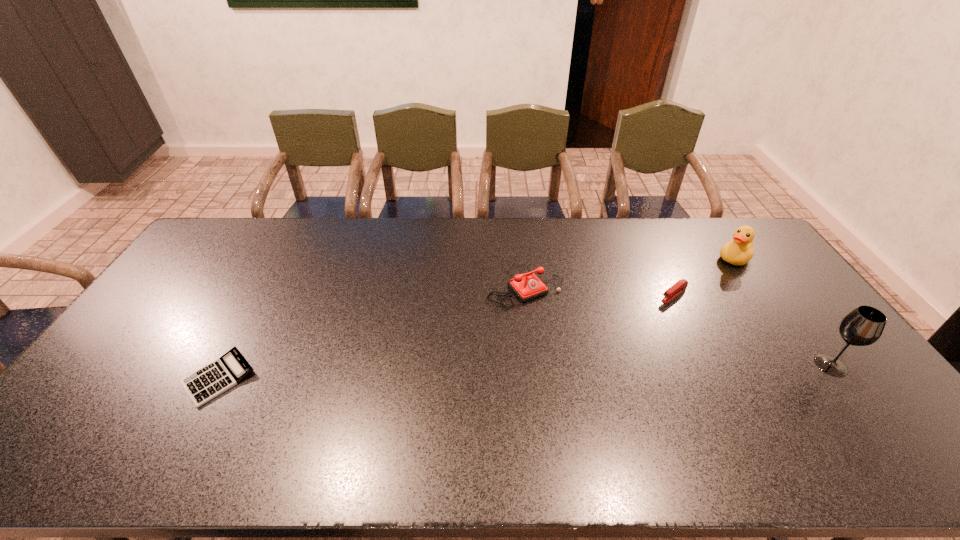
Where is `vacant spot on the desktop that is between the calculator and the wineglass and is positioned on the dial of the telephone`? vacant spot on the desktop that is between the calculator and the wineglass and is positioned on the dial of the telephone is located at coordinates (600, 370).

Find the location of `free spot on the desktop that is between the leftmost object and the wineglass and is positioned on the front-facing side of the third object from left to right`. free spot on the desktop that is between the leftmost object and the wineglass and is positioned on the front-facing side of the third object from left to right is located at coordinates (573, 370).

You are a GUI agent. You are given a task and a screenshot of the screen. Output one action in this format:
    pyautogui.click(x=<x>, y=<y>)
    Task: Click on the vacant spot on the desktop that is between the shortest object and the tallest object and is positioned at the beak of the second tallest object
    
    Given the screenshot: What is the action you would take?
    pyautogui.click(x=609, y=370)